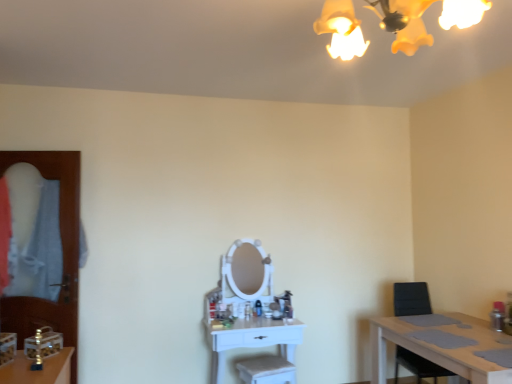
Image resolution: width=512 pixels, height=384 pixels. Find the location of `blank space above light brown wooden table at lower right, the second table in the left-to-right sequence (from a real-world perspective)`. blank space above light brown wooden table at lower right, the second table in the left-to-right sequence (from a real-world perspective) is located at coordinates (467, 334).